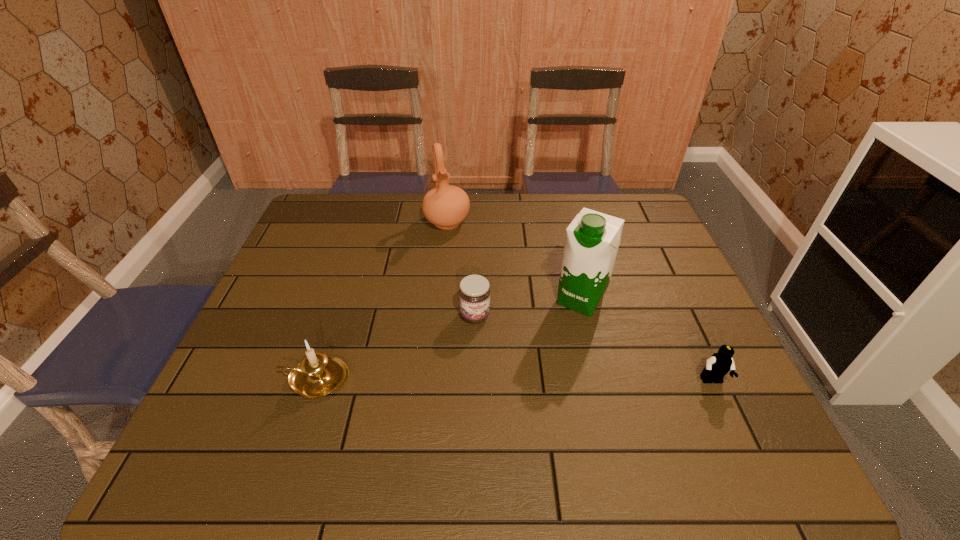
The width and height of the screenshot is (960, 540). Find the location of `free area in between the leftmost object and the second object from right to left`. free area in between the leftmost object and the second object from right to left is located at coordinates (448, 339).

Choose which object is the fourth nearest neighbor to the Lego. Please provide its 2D coordinates. Your answer should be formatted as a tuple, i.e. [(x, y)], where the tuple contains the x and y coordinates of a point satisfying the conditions above.

[(317, 375)]

Where is `object that can be found as the second closest to the leftmost object`? This screenshot has width=960, height=540. object that can be found as the second closest to the leftmost object is located at coordinates (445, 206).